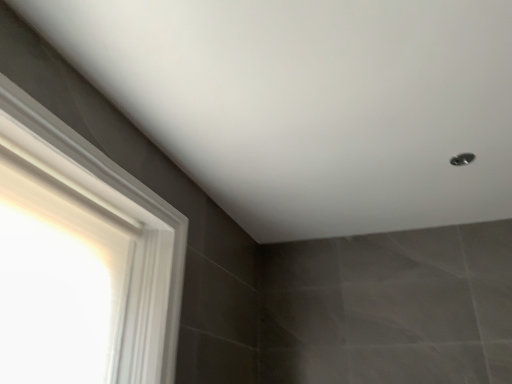
Question: Does metallic silver shower at upper right have a lesser height compared to white glossy frame at left?

Choices:
 (A) yes
 (B) no

Answer: (A)

Question: Would you consider metallic silver shower at upper right to be distant from white glossy frame at left?

Choices:
 (A) yes
 (B) no

Answer: (A)

Question: Considering the relative sizes of metallic silver shower at upper right and white glossy frame at left in the image provided, is metallic silver shower at upper right wider than white glossy frame at left?

Choices:
 (A) yes
 (B) no

Answer: (B)

Question: From the image's perspective, is metallic silver shower at upper right over white glossy frame at left?

Choices:
 (A) yes
 (B) no

Answer: (A)

Question: Would you say white glossy frame at left is part of metallic silver shower at upper right's contents?

Choices:
 (A) yes
 (B) no

Answer: (B)

Question: Is metallic silver shower at upper right positioned in front of white glossy frame at left?

Choices:
 (A) yes
 (B) no

Answer: (B)

Question: Is white glossy frame at left far from metallic silver shower at upper right?

Choices:
 (A) yes
 (B) no

Answer: (A)

Question: Is white glossy frame at left not inside metallic silver shower at upper right?

Choices:
 (A) no
 (B) yes

Answer: (B)

Question: Does white glossy frame at left turn towards metallic silver shower at upper right?

Choices:
 (A) no
 (B) yes

Answer: (B)

Question: Does white glossy frame at left have a greater width compared to metallic silver shower at upper right?

Choices:
 (A) no
 (B) yes

Answer: (B)

Question: Does white glossy frame at left appear on the right side of metallic silver shower at upper right?

Choices:
 (A) no
 (B) yes

Answer: (A)

Question: Does white glossy frame at left have a greater height compared to metallic silver shower at upper right?

Choices:
 (A) yes
 (B) no

Answer: (A)

Question: Considering the positions of point (464, 162) and point (154, 324), is point (464, 162) closer or farther from the camera than point (154, 324)?

Choices:
 (A) closer
 (B) farther

Answer: (B)